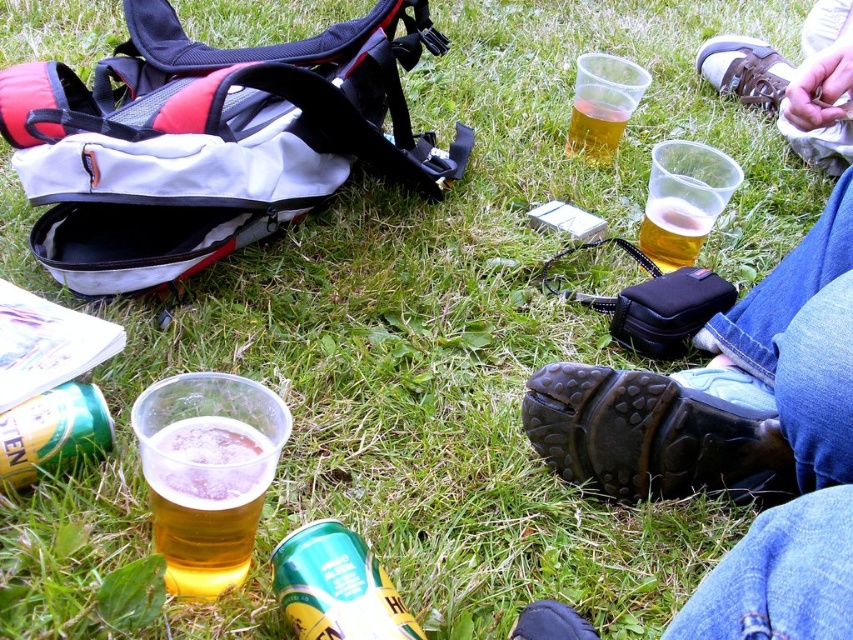
Can you confirm if blue denim jeans at lower right is thinner than translucent plastic cup at lower left?

Incorrect, blue denim jeans at lower right's width is not less than translucent plastic cup at lower left's.

Is blue denim jeans at lower right below translucent plastic cup at lower left?

No.

Who is more distant from viewer, (830, 17) or (248, 458)?

Point (830, 17)

Image resolution: width=853 pixels, height=640 pixels. Identify the location of blue denim jeans at lower right. (738, 438).

Does green matte can at lower left have a greater height compared to black rubber shoe at lower center?

Indeed, green matte can at lower left has a greater height compared to black rubber shoe at lower center.

Which of these two, green matte can at lower left or black rubber shoe at lower center, stands taller?

Standing taller between the two is green matte can at lower left.

Locate an element on the screen. This screenshot has width=853, height=640. green matte can at lower left is located at coordinates coord(51,433).

Between brown leather shoe at upper right and black rubber shoe at lower center, which one has less height?

black rubber shoe at lower center

Is brown leather shoe at upper right bigger than black rubber shoe at lower center?

Correct, brown leather shoe at upper right is larger in size than black rubber shoe at lower center.

Identify the location of brown leather shoe at upper right. The width and height of the screenshot is (853, 640). (744, 70).